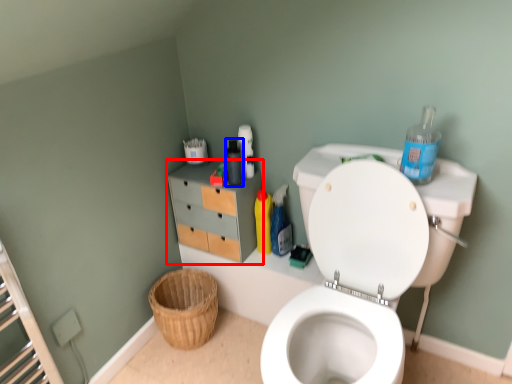
Question: Which point is further to the camera, file cabinet (highlighted by a red box) or bottle (highlighted by a blue box)?

Choices:
 (A) file cabinet
 (B) bottle

Answer: (A)